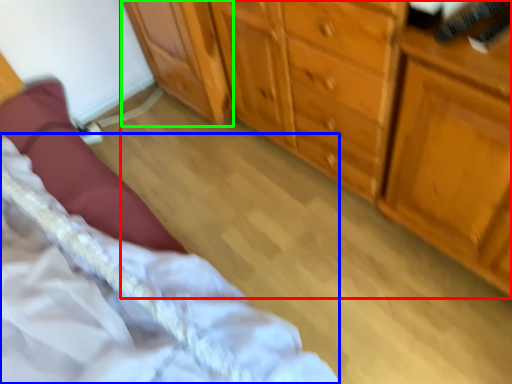
Question: Which object is positioned farthest from chest of drawers (highlighted by a red box)? Select from bed (highlighted by a blue box) and cabinetry (highlighted by a green box).

Choices:
 (A) bed
 (B) cabinetry

Answer: (A)